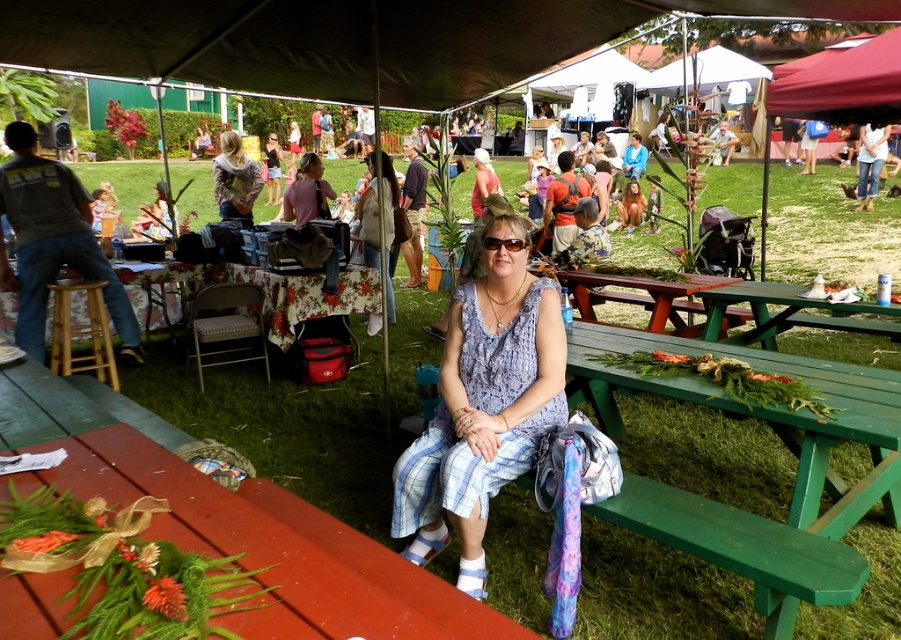
You are standing at the picnic area and want to know which of the two points, point [62,182] or point [396,193], is nearer to you. Based on the scene description, can you determine which one is closer?

Point [62,182] is closer to the viewer than point [396,193].

You are organizing a photo shoot and need to ensure that the gray cotton shirt at left and denim jeans at center are both visible in the frame. Based on their sizes, which one might require more careful framing to avoid being cropped out?

The denim jeans at center might require more careful framing to avoid being cropped out since the gray cotton shirt at left is smaller in size and occupies less space than the denim jeans at center.

You are at a community event and want to find a place to sit. You see the green wood picnic table at center and the camouflage hoodie at center. Which object is lower in height?

The green wood picnic table at center is located below the camouflage hoodie at center, so it is lower in height.